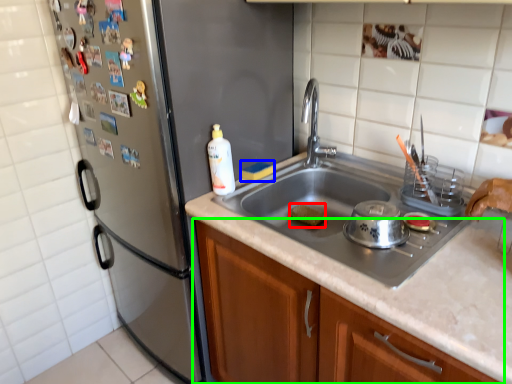
Question: Which object is the farthest from food (highlighted by a red box)? Choose among these: food (highlighted by a blue box) or cabinetry (highlighted by a green box).

Choices:
 (A) food
 (B) cabinetry

Answer: (B)